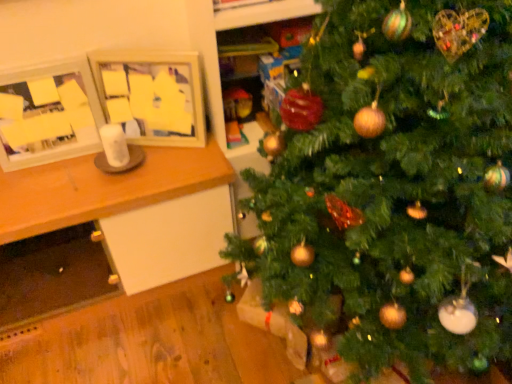
Question: Based on their sizes in the image, would you say wooden picture frame at upper left, acting as the second picture frame starting from the left, is bigger or smaller than wooden table at left?

Choices:
 (A) small
 (B) big

Answer: (A)

Question: Is wooden picture frame at upper left, marked as the 1th picture frame in a right-to-left arrangement, spatially inside wooden table at left, or outside of it?

Choices:
 (A) inside
 (B) outside

Answer: (B)

Question: Estimate the real-world distances between objects in this image. Which object is closer to the wooden table at left?

Choices:
 (A) wooden picture frame at upper left, acting as the second picture frame starting from the left
 (B) green matte christmas tree at center
 (C) matte wooden picture frame at left, the first picture frame viewed from the left

Answer: (C)

Question: Which is farther from the green matte christmas tree at center?

Choices:
 (A) wooden picture frame at upper left, acting as the second picture frame starting from the left
 (B) wooden table at left
 (C) matte wooden picture frame at left, the first picture frame viewed from the left

Answer: (C)